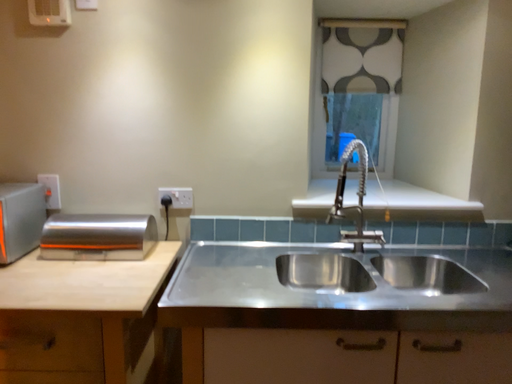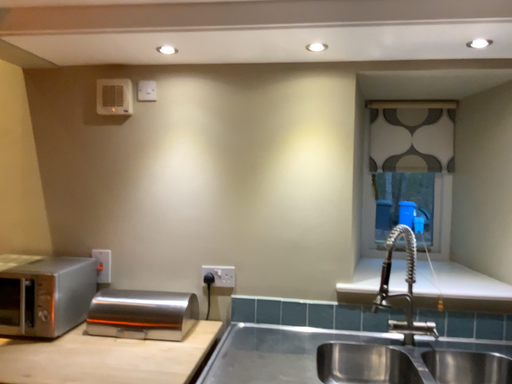
Question: How did the camera likely rotate when shooting the video?

Choices:
 (A) rotated upward
 (B) rotated downward

Answer: (A)